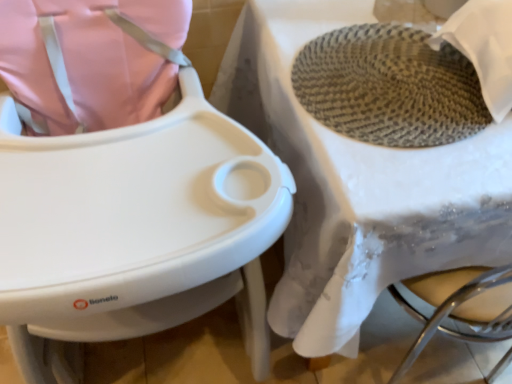
Describe the element at coordinates (357, 186) in the screenshot. I see `white textured table at center` at that location.

Locate an element on the screen. Image resolution: width=512 pixels, height=384 pixels. white textured table at center is located at coordinates (357, 186).

What do you see at coordinates (140, 232) in the screenshot?
I see `rattan textured basket at upper right` at bounding box center [140, 232].

The width and height of the screenshot is (512, 384). I want to click on rattan textured basket at upper right, so click(140, 232).

Locate an element on the screen. white textured table at center is located at coordinates (357, 186).

Based on their positions, is white textured table at center located to the left or right of rattan textured basket at upper right?

In the image, white textured table at center appears on the right side of rattan textured basket at upper right.

Relative to rattan textured basket at upper right, is white textured table at center in front or behind?

white textured table at center is behind rattan textured basket at upper right.

Is point (454, 263) more distant than point (206, 136)?

That is True.

From the image's perspective, between white textured table at center and rattan textured basket at upper right, which one is located above?

white textured table at center, from the image's perspective.

From a real-world perspective, is white textured table at center above or below rattan textured basket at upper right?

Clearly, from a real-world perspective, white textured table at center is below rattan textured basket at upper right.

Considering the relative sizes of white textured table at center and rattan textured basket at upper right in the image provided, is white textured table at center thinner than rattan textured basket at upper right?

No.

Does white textured table at center have a lesser height compared to rattan textured basket at upper right?

Yes, white textured table at center is shorter than rattan textured basket at upper right.

Does white textured table at center have a larger size compared to rattan textured basket at upper right?

No.

Is white textured table at center located outside rattan textured basket at upper right?

white textured table at center lies outside rattan textured basket at upper right's area.

Is white textured table at center beside rattan textured basket at upper right?

white textured table at center is not next to rattan textured basket at upper right, and they're not touching.

Is white textured table at center oriented towards rattan textured basket at upper right?

No, white textured table at center is not oriented towards rattan textured basket at upper right.

How different are the orientations of white textured table at center and rattan textured basket at upper right in degrees?

white textured table at center and rattan textured basket at upper right are facing 1.05 degrees away from each other.

At what (x,y) coordinates should I click in order to perform the action: click on toilet below the white textured table at center (from the image's perspective). Please return your answer as a coordinate pair (x, y). Image resolution: width=512 pixels, height=384 pixels. Looking at the image, I should click on (140, 232).

Would you say rattan textured basket at upper right is to the left or to the right of white textured table at center in the picture?

rattan textured basket at upper right is positioned on white textured table at center's left side.

Is the depth of rattan textured basket at upper right less than that of white textured table at center?

Yes, rattan textured basket at upper right is closer to the camera.

Between point (208, 302) and point (283, 298), which one is positioned behind?

The point (208, 302) is farther from the camera.

From the image's perspective, which object appears higher, rattan textured basket at upper right or white textured table at center?

white textured table at center is shown above in the image.

Consider the image. From a real-world perspective, is rattan textured basket at upper right physically above white textured table at center?

Yes, from a real-world perspective, rattan textured basket at upper right is above white textured table at center.

Considering the relative sizes of rattan textured basket at upper right and white textured table at center in the image provided, is rattan textured basket at upper right thinner than white textured table at center?

Indeed, rattan textured basket at upper right has a lesser width compared to white textured table at center.

Does rattan textured basket at upper right have a lesser height compared to white textured table at center?

Incorrect, the height of rattan textured basket at upper right does not fall short of that of white textured table at center.

Can you confirm if rattan textured basket at upper right is bigger than white textured table at center?

Correct, rattan textured basket at upper right is larger in size than white textured table at center.

Is white textured table at center surrounded by rattan textured basket at upper right?

No, white textured table at center is located outside of rattan textured basket at upper right.

Are rattan textured basket at upper right and white textured table at center located far from each other?

No.

Is white textured table at center at the back of rattan textured basket at upper right?

No, rattan textured basket at upper right's orientation is not away from white textured table at center.

Identify the location of toilet that appears in front of the white textured table at center. The width and height of the screenshot is (512, 384). (140, 232).

Where is `table behind the rattan textured basket at upper right`? The height and width of the screenshot is (384, 512). table behind the rattan textured basket at upper right is located at coordinates (357, 186).

I want to click on table above the rattan textured basket at upper right (from the image's perspective), so click(x=357, y=186).